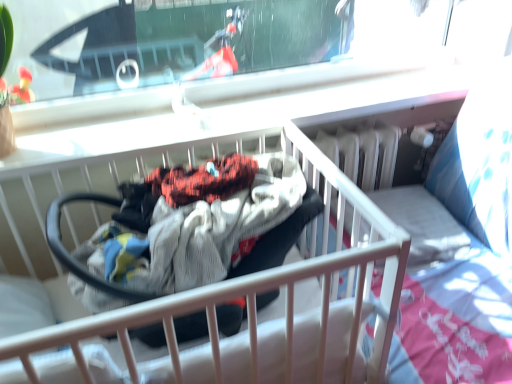
What do you see at coordinates (205, 231) in the screenshot? I see `black rubber baby carriage at center` at bounding box center [205, 231].

Where is `black rubber baby carriage at center`? The image size is (512, 384). black rubber baby carriage at center is located at coordinates (205, 231).

Based on the photo, in order to face black rubber baby carriage at center, should I rotate leftwards or rightwards?

It's best to rotate left around 9.842 degrees.

The image size is (512, 384). I want to click on white fabric infant bed at center, so click(255, 306).

Describe the element at coordinates (255, 306) in the screenshot. This screenshot has height=384, width=512. I see `white fabric infant bed at center` at that location.

At what (x,y) coordinates should I click in order to perform the action: click on black rubber baby carriage at center. Please return your answer as a coordinate pair (x, y). Looking at the image, I should click on (205, 231).

Is black rubber baby carriage at center to the right of white fabric infant bed at center from the viewer's perspective?

Yes, black rubber baby carriage at center is to the right of white fabric infant bed at center.

Which object is further away from the camera taking this photo, black rubber baby carriage at center or white fabric infant bed at center?

black rubber baby carriage at center is further from the camera.

Is point (273, 200) closer or farther from the camera than point (236, 360)?

Point (273, 200) is farther from the camera than point (236, 360).

From the image's perspective, which is above, black rubber baby carriage at center or white fabric infant bed at center?

black rubber baby carriage at center, from the image's perspective.

From a real-world perspective, is black rubber baby carriage at center physically located above or below white fabric infant bed at center?

In terms of real-world spatial position, black rubber baby carriage at center is above white fabric infant bed at center.

Which of these two, black rubber baby carriage at center or white fabric infant bed at center, is wider?

With larger width is white fabric infant bed at center.

In the scene shown: Which of these two, black rubber baby carriage at center or white fabric infant bed at center, stands shorter?

black rubber baby carriage at center is shorter.

Based on the photo, considering the relative sizes of black rubber baby carriage at center and white fabric infant bed at center in the image provided, is black rubber baby carriage at center smaller than white fabric infant bed at center?

Indeed, black rubber baby carriage at center has a smaller size compared to white fabric infant bed at center.

Is black rubber baby carriage at center spatially inside white fabric infant bed at center, or outside of it?

black rubber baby carriage at center fits inside white fabric infant bed at center.

Is black rubber baby carriage at center with white fabric infant bed at center?

black rubber baby carriage at center is not next to white fabric infant bed at center, and they're not touching.

Is black rubber baby carriage at center looking in the opposite direction of white fabric infant bed at center?

Correct, black rubber baby carriage at center is looking away from white fabric infant bed at center.

Looking at this image, how much distance is there between black rubber baby carriage at center and white fabric infant bed at center?

A distance of 7.38 inches exists between black rubber baby carriage at center and white fabric infant bed at center.

The image size is (512, 384). What are the coordinates of `baby carriage behind the white fabric infant bed at center` in the screenshot? It's located at (205, 231).

Which is more to the right, white fabric infant bed at center or black rubber baby carriage at center?

From the viewer's perspective, black rubber baby carriage at center appears more on the right side.

Considering the relative positions of white fabric infant bed at center and black rubber baby carriage at center in the image provided, is white fabric infant bed at center in front of black rubber baby carriage at center?

Yes, it is in front of black rubber baby carriage at center.

Considering the positions of points (362, 289) and (213, 218), is point (362, 289) farther from camera compared to point (213, 218)?

No.

From the image's perspective, is white fabric infant bed at center above or below black rubber baby carriage at center?

white fabric infant bed at center is situated lower than black rubber baby carriage at center in the image.

From a real-world perspective, which object rests below the other?

white fabric infant bed at center, from a real-world perspective.

In terms of width, does white fabric infant bed at center look wider or thinner when compared to black rubber baby carriage at center?

Considering their sizes, white fabric infant bed at center looks broader than black rubber baby carriage at center.

Considering the relative sizes of white fabric infant bed at center and black rubber baby carriage at center in the image provided, is white fabric infant bed at center shorter than black rubber baby carriage at center?

No, white fabric infant bed at center is not shorter than black rubber baby carriage at center.

In terms of size, does white fabric infant bed at center appear bigger or smaller than black rubber baby carriage at center?

Clearly, white fabric infant bed at center is larger in size than black rubber baby carriage at center.

Does white fabric infant bed at center contain black rubber baby carriage at center?

That's correct, black rubber baby carriage at center is inside white fabric infant bed at center.

Is white fabric infant bed at center next to black rubber baby carriage at center?

No, white fabric infant bed at center is not touching black rubber baby carriage at center.

Is white fabric infant bed at center looking in the opposite direction of black rubber baby carriage at center?

That's right, white fabric infant bed at center is facing away from black rubber baby carriage at center.

How different are the orientations of white fabric infant bed at center and black rubber baby carriage at center in degrees?

There is a 2.21-degree angle between the facing directions of white fabric infant bed at center and black rubber baby carriage at center.

Locate an element on the screen. infant bed that appears below the black rubber baby carriage at center (from a real-world perspective) is located at coordinates (255, 306).

Locate an element on the screen. This screenshot has width=512, height=384. infant bed that appears in front of the black rubber baby carriage at center is located at coordinates (255, 306).

Find the location of a particular element. infant bed below the black rubber baby carriage at center (from the image's perspective) is located at coordinates (255, 306).